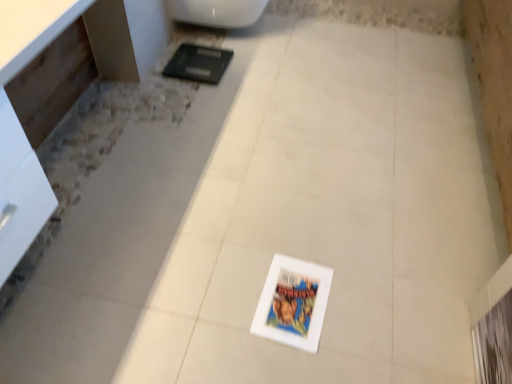
The height and width of the screenshot is (384, 512). Describe the element at coordinates (85, 62) in the screenshot. I see `white glossy vanity at left` at that location.

At what (x,y) coordinates should I click in order to perform the action: click on white glossy vanity at left. Please return your answer as a coordinate pair (x, y). The height and width of the screenshot is (384, 512). Looking at the image, I should click on (85, 62).

The height and width of the screenshot is (384, 512). In order to click on white glossy toilet at upper center in this screenshot , I will do `click(217, 12)`.

This screenshot has height=384, width=512. What do you see at coordinates (217, 12) in the screenshot?
I see `white glossy toilet at upper center` at bounding box center [217, 12].

Where is `white glossy vanity at left`? This screenshot has height=384, width=512. white glossy vanity at left is located at coordinates (85, 62).

In the scene shown: Is white glossy toilet at upper center to the left of white glossy vanity at left from the viewer's perspective?

No, white glossy toilet at upper center is not to the left of white glossy vanity at left.

Considering their positions, is white glossy toilet at upper center located in front of or behind white glossy vanity at left?

Visually, white glossy toilet at upper center is located behind white glossy vanity at left.

Is point (256, 8) positioned before point (147, 12)?

No.

From the image's perspective, is white glossy toilet at upper center over white glossy vanity at left?

Indeed, from the image's perspective, white glossy toilet at upper center is shown above white glossy vanity at left.

From a real-world perspective, is white glossy toilet at upper center located higher than white glossy vanity at left?

Incorrect, from a real-world perspective, white glossy toilet at upper center is lower than white glossy vanity at left.

Which of these two, white glossy toilet at upper center or white glossy vanity at left, is wider?

white glossy toilet at upper center.

Does white glossy toilet at upper center have a greater height compared to white glossy vanity at left?

Incorrect, the height of white glossy toilet at upper center is not larger of that of white glossy vanity at left.

Is white glossy toilet at upper center smaller than white glossy vanity at left?

Yes, white glossy toilet at upper center is smaller than white glossy vanity at left.

Is white glossy toilet at upper center situated inside white glossy vanity at left or outside?

The correct answer is: outside.

Is white glossy toilet at upper center with white glossy vanity at left?

white glossy toilet at upper center and white glossy vanity at left are not in contact.

Is white glossy toilet at upper center oriented away from white glossy vanity at left?

No, white glossy vanity at left is not at the back of white glossy toilet at upper center.

From the picture: How different are the orientations of white glossy toilet at upper center and white glossy vanity at left in degrees?

white glossy toilet at upper center and white glossy vanity at left are facing 0.000379 degrees away from each other.

Measure the distance between white glossy toilet at upper center and white glossy vanity at left.

white glossy toilet at upper center is 20.90 inches from white glossy vanity at left.

At what (x,y) coordinates should I click in order to perform the action: click on toilet below the white glossy vanity at left (from a real-world perspective). Please return your answer as a coordinate pair (x, y). Looking at the image, I should click on pos(217,12).

Is white glossy vanity at left at the right side of white glossy toilet at upper center?

No, white glossy vanity at left is not to the right of white glossy toilet at upper center.

Which is in front, white glossy vanity at left or white glossy toilet at upper center?

white glossy vanity at left is in front.

Is point (6, 305) positioned before point (233, 21)?

That is True.

From the image's perspective, is white glossy vanity at left under white glossy toilet at upper center?

Yes, from the image's perspective, white glossy vanity at left is below white glossy toilet at upper center.

From a real-world perspective, is white glossy vanity at left beneath white glossy toilet at upper center?

No.

Which of these two, white glossy vanity at left or white glossy toilet at upper center, is thinner?

white glossy vanity at left is thinner.

Does white glossy vanity at left have a lesser height compared to white glossy toilet at upper center?

No, white glossy vanity at left is not shorter than white glossy toilet at upper center.

Is white glossy vanity at left bigger or smaller than white glossy toilet at upper center?

Clearly, white glossy vanity at left is larger in size than white glossy toilet at upper center.

Consider the image. Is white glossy vanity at left spatially inside white glossy toilet at upper center, or outside of it?

white glossy vanity at left exists outside the volume of white glossy toilet at upper center.

Is white glossy vanity at left far away from white glossy toilet at upper center?

Actually, white glossy vanity at left and white glossy toilet at upper center are a little close together.

Consider the image. Is white glossy vanity at left looking in the opposite direction of white glossy toilet at upper center?

That's not correct — white glossy vanity at left is not looking away from white glossy toilet at upper center.

You are a GUI agent. You are given a task and a screenshot of the screen. Output one action in this format:
    pyautogui.click(x=<x>, y=<y>)
    Task: Click on the vanity above the white glossy toilet at upper center (from a real-world perspective)
    This screenshot has height=384, width=512.
    Given the screenshot: What is the action you would take?
    pyautogui.click(x=85, y=62)

Find the location of a particular element. The image size is (512, 384). toilet that is above the white glossy vanity at left (from the image's perspective) is located at coordinates (217, 12).

Where is `toilet located underneath the white glossy vanity at left (from a real-world perspective)`? This screenshot has height=384, width=512. toilet located underneath the white glossy vanity at left (from a real-world perspective) is located at coordinates (x=217, y=12).